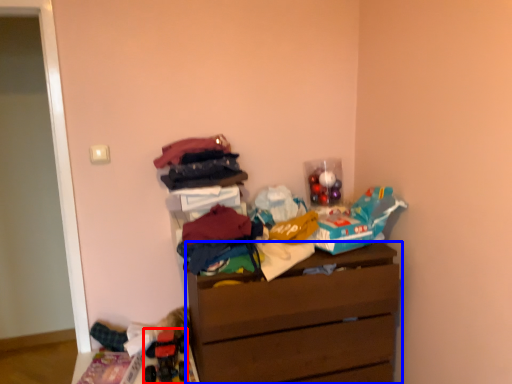
Question: Which of the following is the farthest to the observer, toy (highlighted by a red box) or chest of drawers (highlighted by a blue box)?

Choices:
 (A) toy
 (B) chest of drawers

Answer: (A)